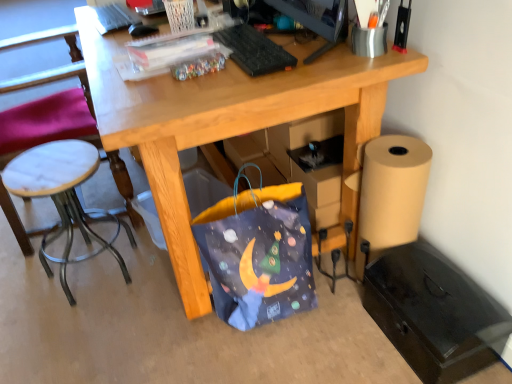
Locate an element on the screen. The width and height of the screenshot is (512, 384). free space above black matte file cabinet at lower right (from a real-world perspective) is located at coordinates (439, 304).